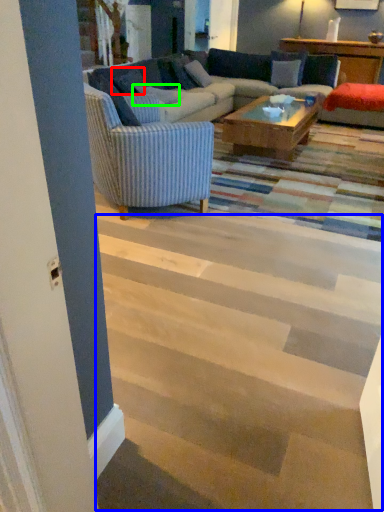
Question: Based on their relative distances, which object is nearer to pillow (highlighted by a red box)? Choose from stairwell (highlighted by a blue box) and pillow (highlighted by a green box).

Choices:
 (A) stairwell
 (B) pillow

Answer: (B)